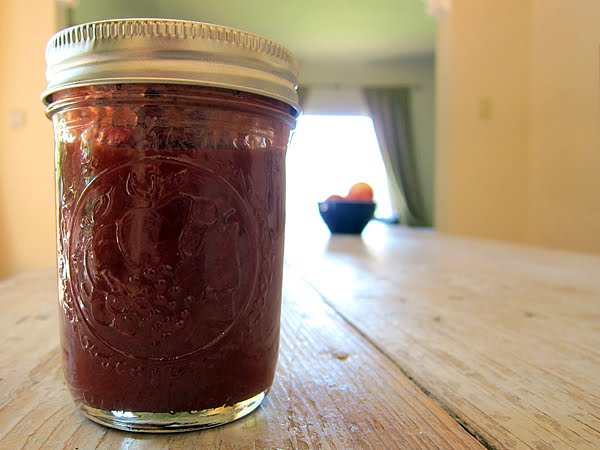
I want to click on empty space on table, so click(x=389, y=272).